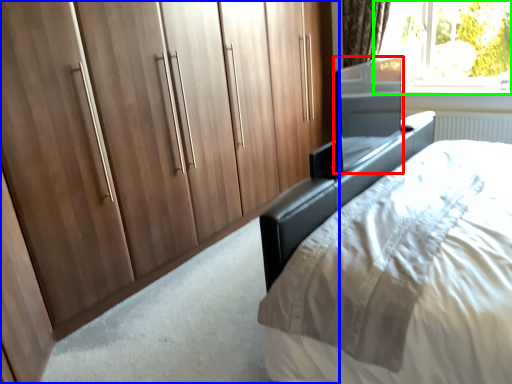
Question: Considering the real-world distances, which object is closest to screen door (highlighted by a red box)? cupboard (highlighted by a blue box) or window (highlighted by a green box).

Choices:
 (A) cupboard
 (B) window

Answer: (A)